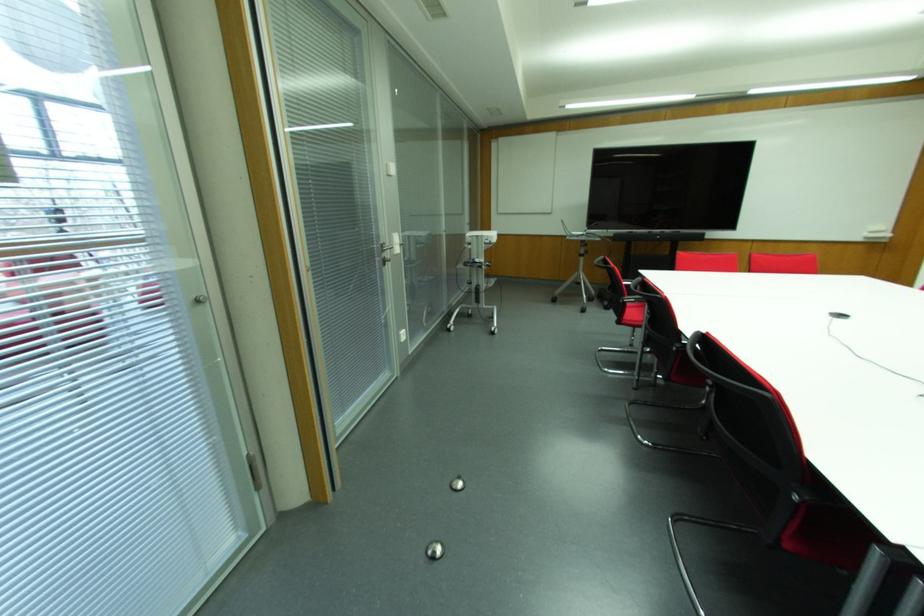
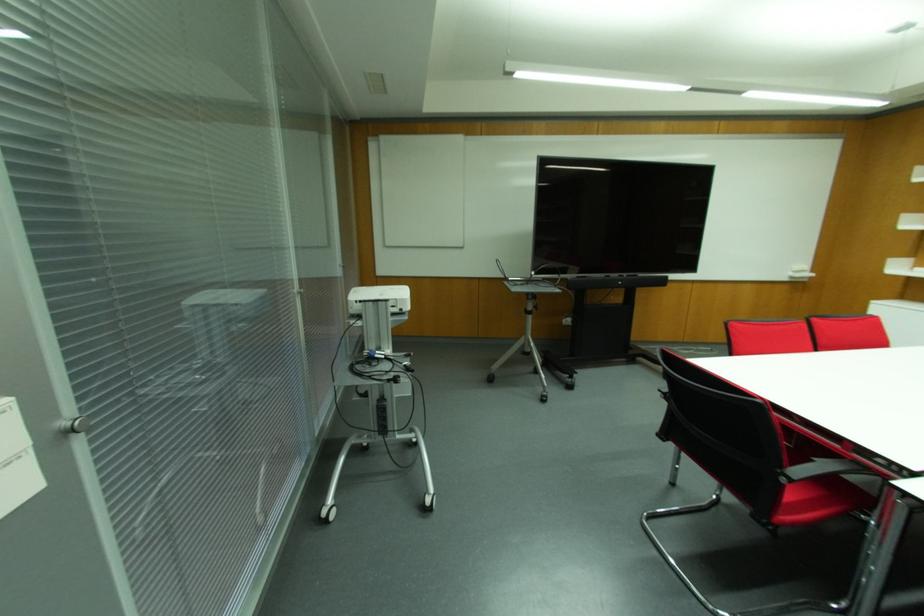
The point at (492, 236) is marked in the first image. Where is the corresponding point in the second image?

(399, 294)